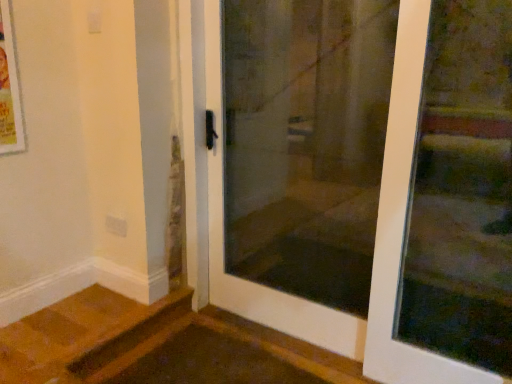
Question: Is transparent glass screen door at center bigger than white glass door at center, which ranks as the first door in left-to-right order?

Choices:
 (A) yes
 (B) no

Answer: (B)

Question: Are transparent glass screen door at center and white glass door at center, which is the second door in right-to-left order, beside each other?

Choices:
 (A) no
 (B) yes

Answer: (B)

Question: Is transparent glass screen door at center oriented towards white glass door at center, which ranks as the first door in left-to-right order?

Choices:
 (A) yes
 (B) no

Answer: (A)

Question: From the image's perspective, does transparent glass screen door at center appear higher than white glass door at center, which ranks as the first door in left-to-right order?

Choices:
 (A) yes
 (B) no

Answer: (A)

Question: Considering the relative positions of transparent glass screen door at center and white glass door at center, which is the second door in right-to-left order, in the image provided, is transparent glass screen door at center to the left of white glass door at center, which is the second door in right-to-left order, from the viewer's perspective?

Choices:
 (A) no
 (B) yes

Answer: (B)

Question: Is transparent glass door at upper right, which is the second door from left to right, wider or thinner than white glass door at center, which ranks as the first door in left-to-right order?

Choices:
 (A) thin
 (B) wide

Answer: (A)

Question: Is transparent glass door at upper right, placed as the first door when sorted from right to left, taller or shorter than white glass door at center, which is the second door in right-to-left order?

Choices:
 (A) short
 (B) tall

Answer: (A)

Question: Is point (422, 112) positioned closer to the camera than point (499, 173)?

Choices:
 (A) closer
 (B) farther

Answer: (B)

Question: Considering the relative positions of transparent glass door at upper right, placed as the first door when sorted from right to left, and white glass door at center, which ranks as the first door in left-to-right order, in the image provided, is transparent glass door at upper right, placed as the first door when sorted from right to left, to the left or to the right of white glass door at center, which ranks as the first door in left-to-right order,?

Choices:
 (A) right
 (B) left

Answer: (A)

Question: Is white glass door at center, which is the second door in right-to-left order, inside the boundaries of transparent glass screen door at center, or outside?

Choices:
 (A) outside
 (B) inside

Answer: (A)

Question: From the image's perspective, relative to transparent glass screen door at center, is white glass door at center, which ranks as the first door in left-to-right order, above or below?

Choices:
 (A) above
 (B) below

Answer: (B)

Question: Based on their sizes in the image, would you say white glass door at center, which ranks as the first door in left-to-right order, is bigger or smaller than transparent glass screen door at center?

Choices:
 (A) small
 (B) big

Answer: (B)

Question: Does point (353, 64) appear closer or farther from the camera than point (262, 49)?

Choices:
 (A) farther
 (B) closer

Answer: (B)

Question: From the image's perspective, is transparent glass screen door at center located above or below transparent glass door at upper right, which is the second door from left to right?

Choices:
 (A) above
 (B) below

Answer: (A)

Question: Is transparent glass screen door at center spatially inside transparent glass door at upper right, which is the second door from left to right, or outside of it?

Choices:
 (A) outside
 (B) inside

Answer: (A)